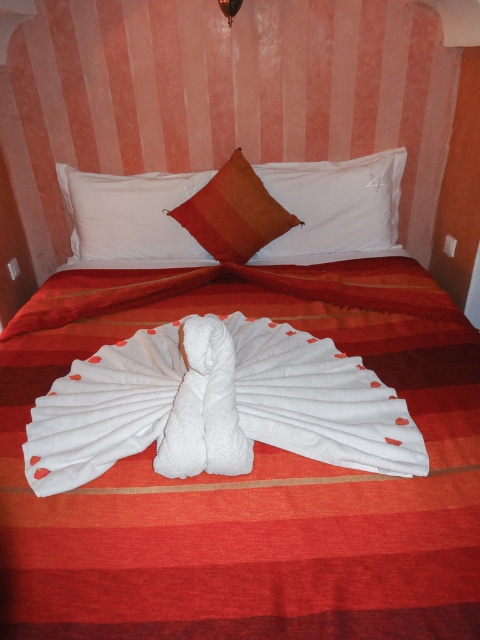
You are arranging flowers in a vase placed on a bedside table next to the bed. You want to place a small vase between the white towel at center and the white soft pillow at upper center. Is there enough space between them to fit the vase?

The white towel at center is to the right of the white soft pillow at upper center, so there is space between them to place the vase.

You are organizing a bed for a guest. You see the white towel at center and the white soft pillow at upper center. Which item is closer to the guest when they are sitting on the bed?

The white towel at center is closer to the guest because it is in front of the white soft pillow at upper center.

You are standing at the foot of the bed and want to place a 4 foot long decorative pillow between the white towel at center and the nearest bedpost. Is there enough space?

The distance between the white towel at center and the nearest bedpost is 4.01 feet. Since the decorative pillow is 4 feet long, there is just enough space to place it between them.